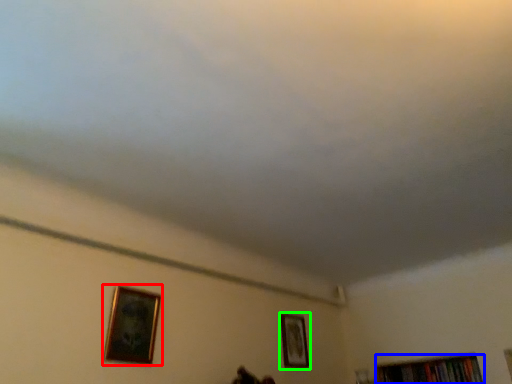
Question: Based on their relative distances, which object is nearer to picture frame (highlighted by a red box)? Choose from book (highlighted by a blue box) and picture frame (highlighted by a green box).

Choices:
 (A) book
 (B) picture frame

Answer: (B)